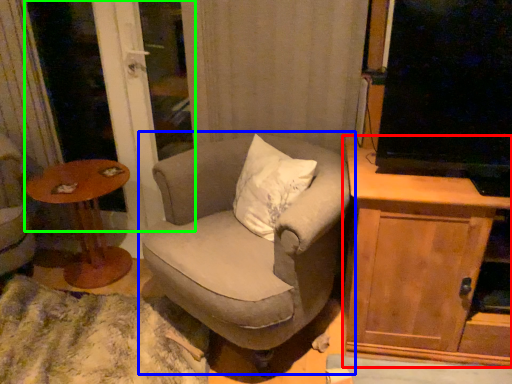
Question: Which object is the farthest from cabinetry (highlighted by a red box)? Choose among these: chair (highlighted by a blue box) or screen door (highlighted by a green box).

Choices:
 (A) chair
 (B) screen door

Answer: (B)